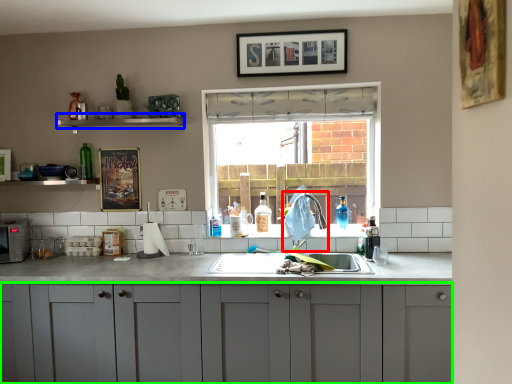
Question: Considering the real-world distances, which object is farthest from faucet (highlighted by a red box)? window sill (highlighted by a blue box) or cabinetry (highlighted by a green box)?

Choices:
 (A) window sill
 (B) cabinetry

Answer: (A)